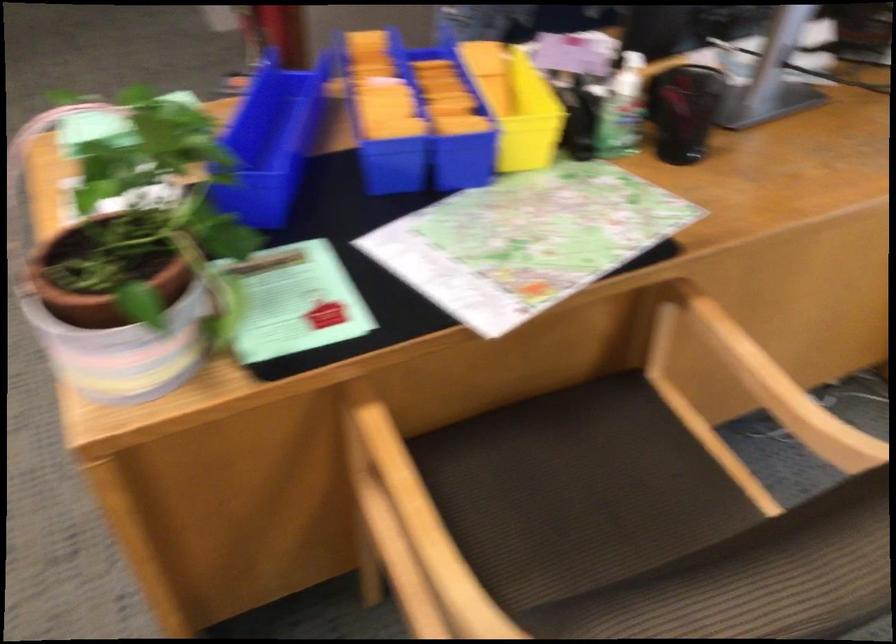
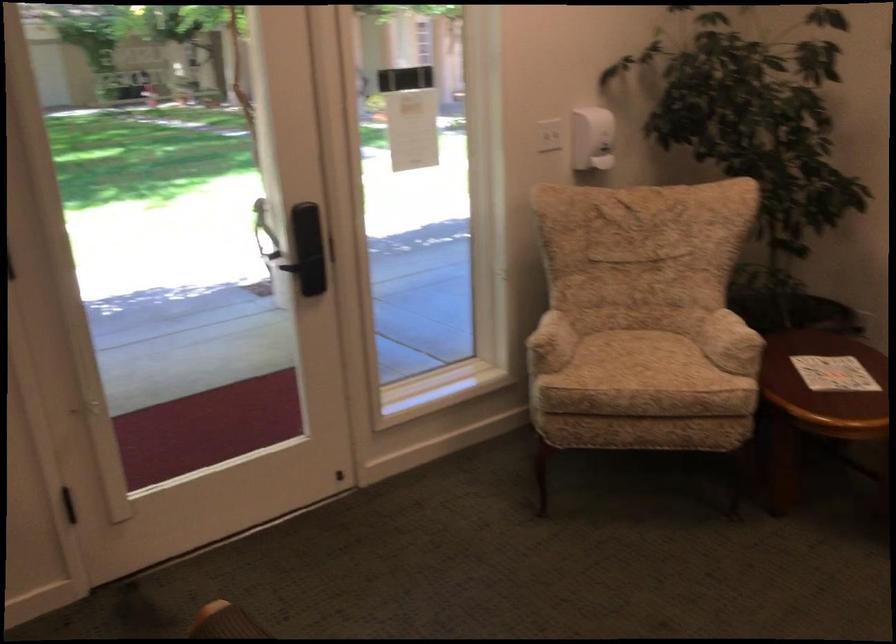
The first image is from the beginning of the video and the second image is from the end. How did the camera likely rotate when shooting the video?

The camera rotated toward right-down.